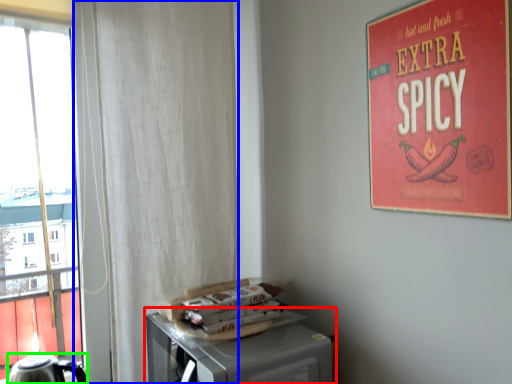
Question: Considering the real-world distances, which object is closest to table (highlighted by a red box)? curtain (highlighted by a blue box) or kettle (highlighted by a green box).

Choices:
 (A) curtain
 (B) kettle

Answer: (A)